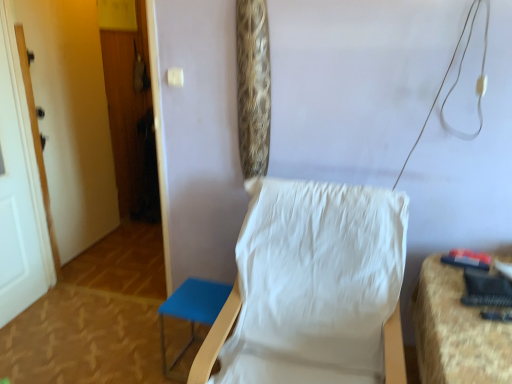
Question: Should I look upward or downward to see white painted wood door at left, the 2th door in the back-to-front sequence?

Choices:
 (A) up
 (B) down

Answer: (A)

Question: Can you confirm if white painted wood door at left, acting as the 1th door starting from the front, is wider than textured fabric chair at right, placed as the 1th furniture when sorted from right to left?

Choices:
 (A) no
 (B) yes

Answer: (A)

Question: Is white painted wood door at left, the 2th door in the back-to-front sequence, oriented towards textured fabric chair at right, which is the 2th furniture from left to right?

Choices:
 (A) yes
 (B) no

Answer: (A)

Question: Is textured fabric chair at right, which is the 2th furniture from left to right, at the back of white painted wood door at left, the 2th door in the back-to-front sequence?

Choices:
 (A) yes
 (B) no

Answer: (B)

Question: Does white painted wood door at left, acting as the 1th door starting from the front, have a smaller size compared to textured fabric chair at right, which is the 2th furniture from left to right?

Choices:
 (A) yes
 (B) no

Answer: (A)

Question: From a real-world perspective, does white painted wood door at left, the 2th door in the back-to-front sequence, sit lower than textured fabric chair at right, placed as the 1th furniture when sorted from right to left?

Choices:
 (A) yes
 (B) no

Answer: (B)

Question: Is white painted wood door at left, acting as the 1th door starting from the front, closer to the viewer compared to textured fabric chair at right, placed as the 1th furniture when sorted from right to left?

Choices:
 (A) no
 (B) yes

Answer: (A)

Question: Is white painted wood door at left, which ranks as the first door in back-to-front order, oriented away from textured fabric chair at right, which is the 2th furniture from left to right?

Choices:
 (A) no
 (B) yes

Answer: (A)

Question: Is white painted wood door at left, the 2th door in the front-to-back sequence, positioned before textured fabric chair at right, placed as the 1th furniture when sorted from right to left?

Choices:
 (A) no
 (B) yes

Answer: (A)

Question: From the image's perspective, does white painted wood door at left, the 2th door in the front-to-back sequence, appear lower than textured fabric chair at right, placed as the 1th furniture when sorted from right to left?

Choices:
 (A) no
 (B) yes

Answer: (A)

Question: From a real-world perspective, is white painted wood door at left, the 2th door in the front-to-back sequence, located higher than textured fabric chair at right, placed as the 1th furniture when sorted from right to left?

Choices:
 (A) no
 (B) yes

Answer: (B)

Question: Considering the relative positions of white painted wood door at left, which ranks as the first door in back-to-front order, and textured fabric chair at right, placed as the 1th furniture when sorted from right to left, in the image provided, is white painted wood door at left, which ranks as the first door in back-to-front order, to the left of textured fabric chair at right, placed as the 1th furniture when sorted from right to left, from the viewer's perspective?

Choices:
 (A) yes
 (B) no

Answer: (A)

Question: Can you confirm if white fabric chair at center is smaller than blue fabric stool at lower left, the 1th furniture viewed from the left?

Choices:
 (A) no
 (B) yes

Answer: (A)